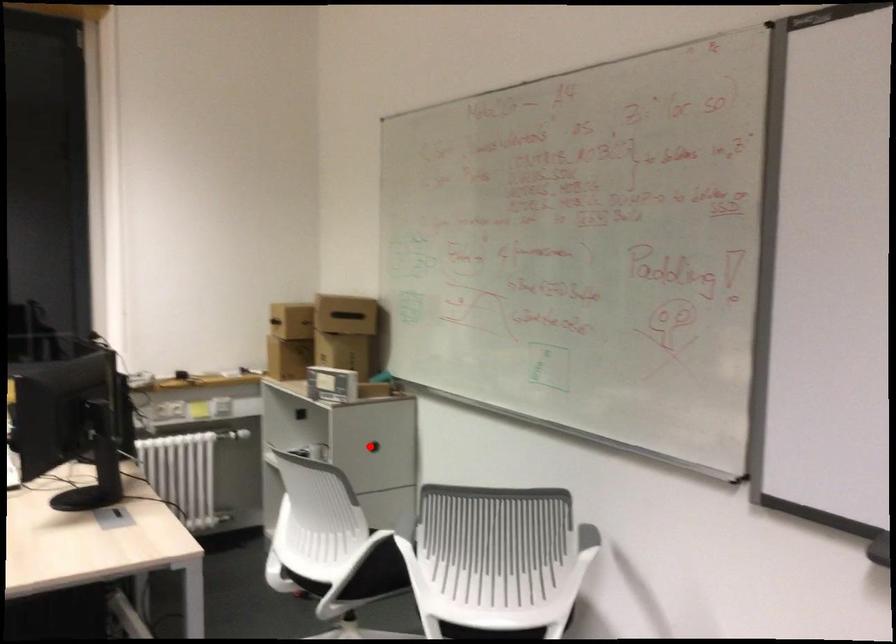
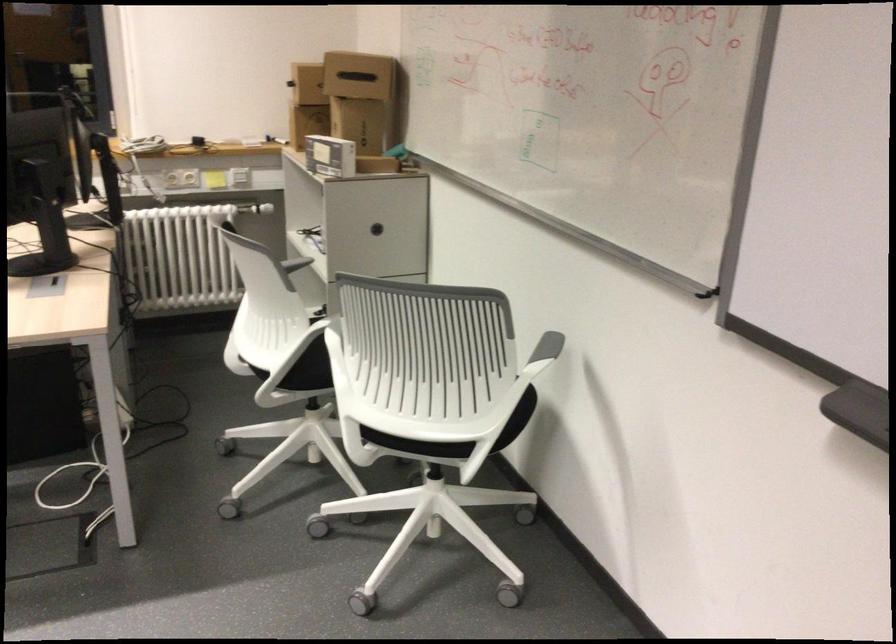
Locate, in the second image, the point that corresponds to the highlighted location in the first image.

(375, 229)